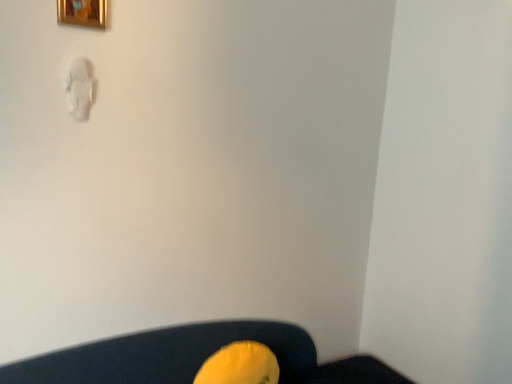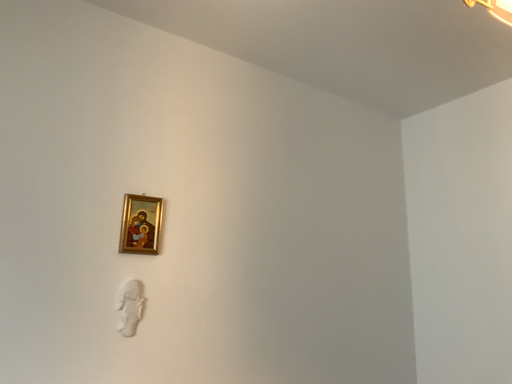
Question: Which way did the camera rotate in the video?

Choices:
 (A) rotated downward
 (B) rotated upward

Answer: (B)